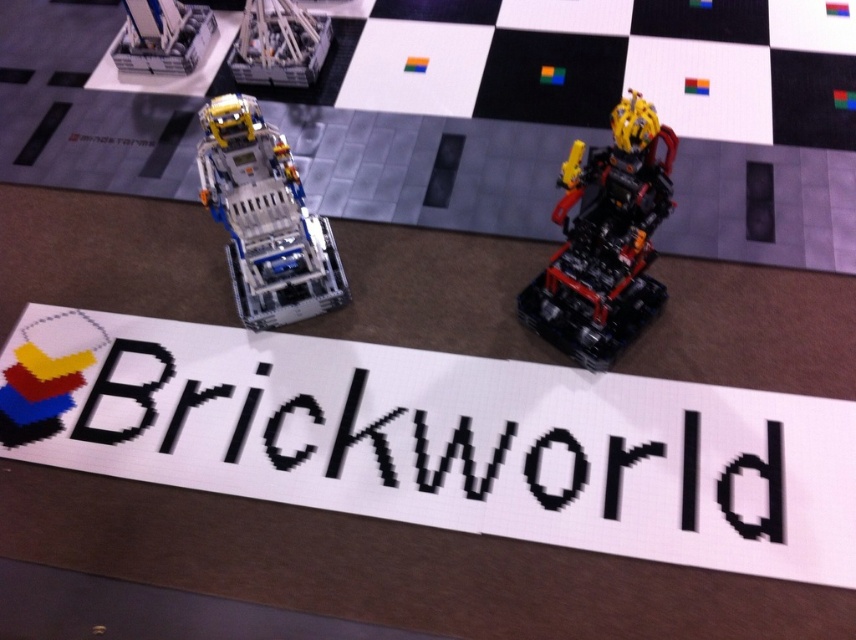
You are a LEGO enthusiast attending Brickworld. You want to take a photo of the black pixelated text at center and the white robot on the left. How far apart are they?

The black pixelated text at center and the white robot on the left are 7.31 feet apart.

You are standing at the entrance of the LEGO Brickworld exhibition and see two points marked in the image. The first point is at coordinates point (304, 316) and the second is at point (306, 77). Which point is nearer to you?

Point (304, 316) is closer to the camera than point (306, 77), so the first point is nearer to you.